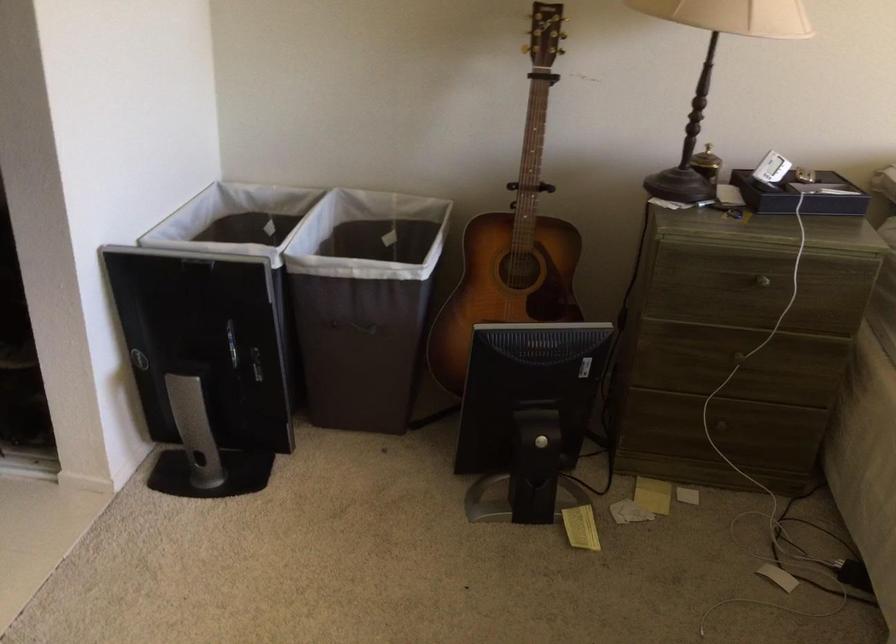
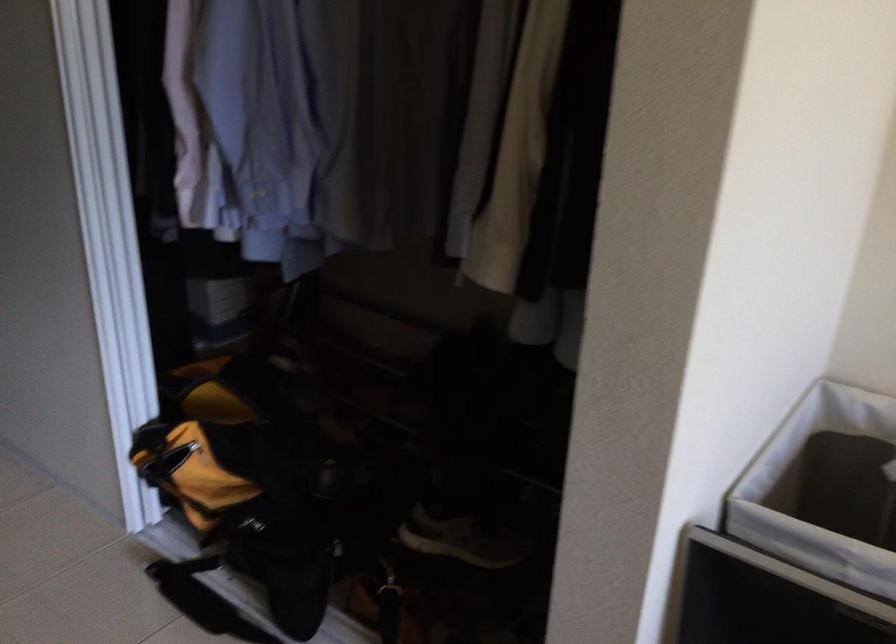
Question: The first image is from the beginning of the video and the second image is from the end. How did the camera likely rotate when shooting the video?

Choices:
 (A) Left
 (B) Right
 (C) Up
 (D) Down

Answer: (A)